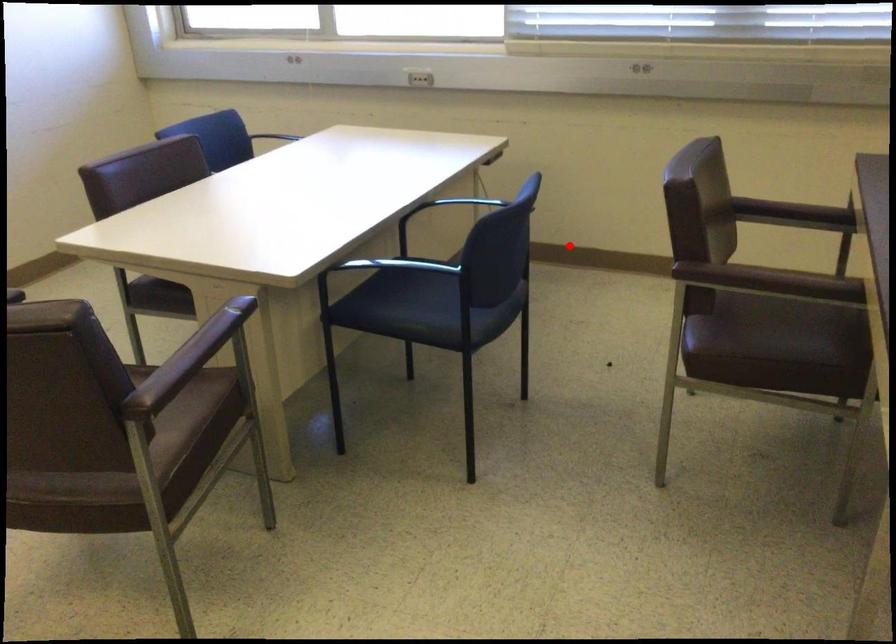
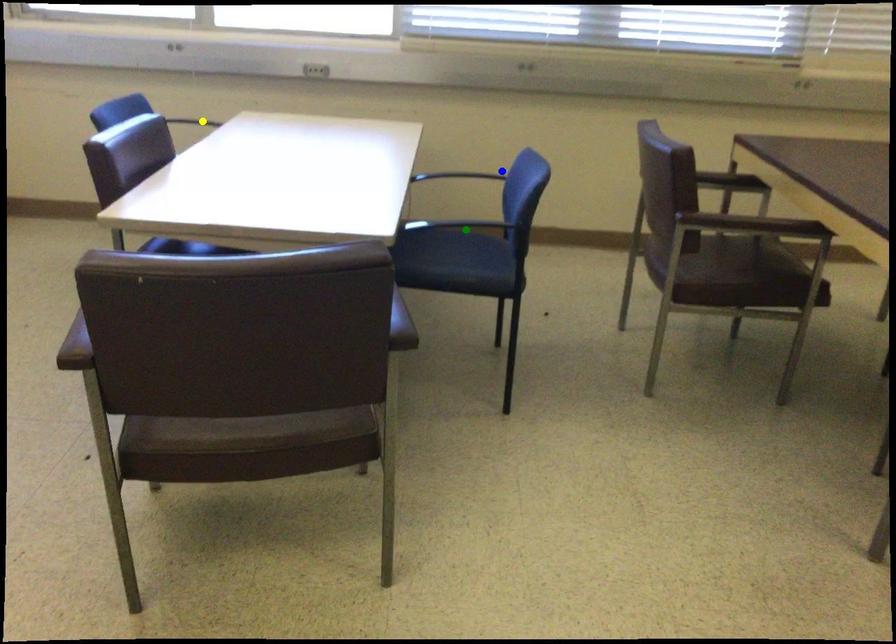
Question: I am providing you with two images of the same scene from different viewpoints. A red point is marked on the first image. You are given multiple points on the second image. Which point in image 2 represents the same 3d spot as the red point in image 1?

Choices:
 (A) blue point
 (B) yellow point
 (C) green point

Answer: (C)